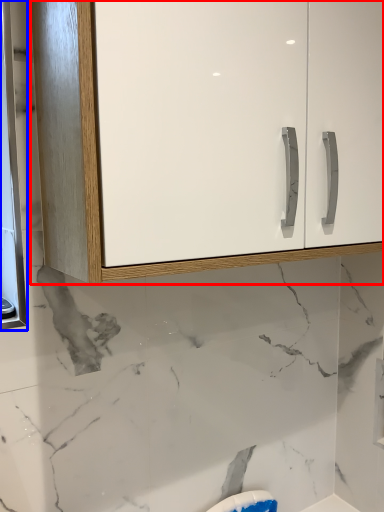
Question: Which object is further to the camera taking this photo, cabinetry (highlighted by a red box) or medicine cabinet (highlighted by a blue box)?

Choices:
 (A) cabinetry
 (B) medicine cabinet

Answer: (B)